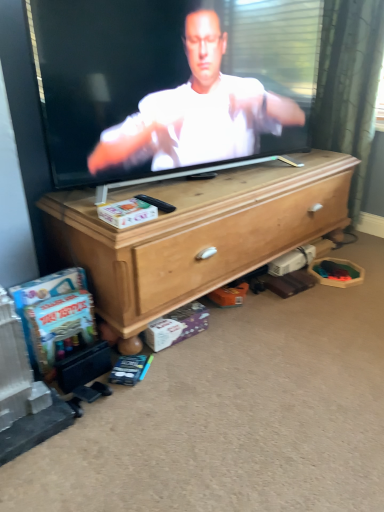
The height and width of the screenshot is (512, 384). In order to click on vacant area that lies between smooth white shirt at center and black plastic remote control at center in this screenshot , I will do `click(219, 189)`.